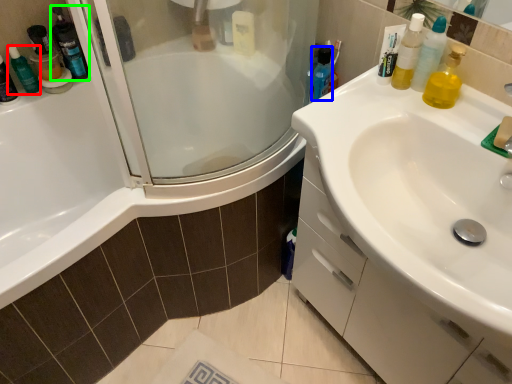
Question: Which is nearer to the toiletry (highlighted by a red box)? mouthwash (highlighted by a blue box) or cleaning product (highlighted by a green box).

Choices:
 (A) mouthwash
 (B) cleaning product

Answer: (B)